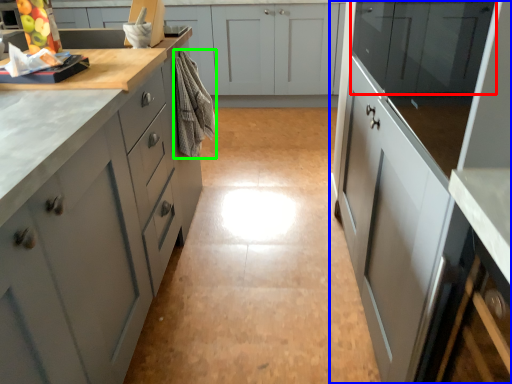
Question: Which object is positioned farthest from cabinetry (highlighted by a red box)? Select from cabinetry (highlighted by a blue box) and material (highlighted by a green box).

Choices:
 (A) cabinetry
 (B) material

Answer: (B)